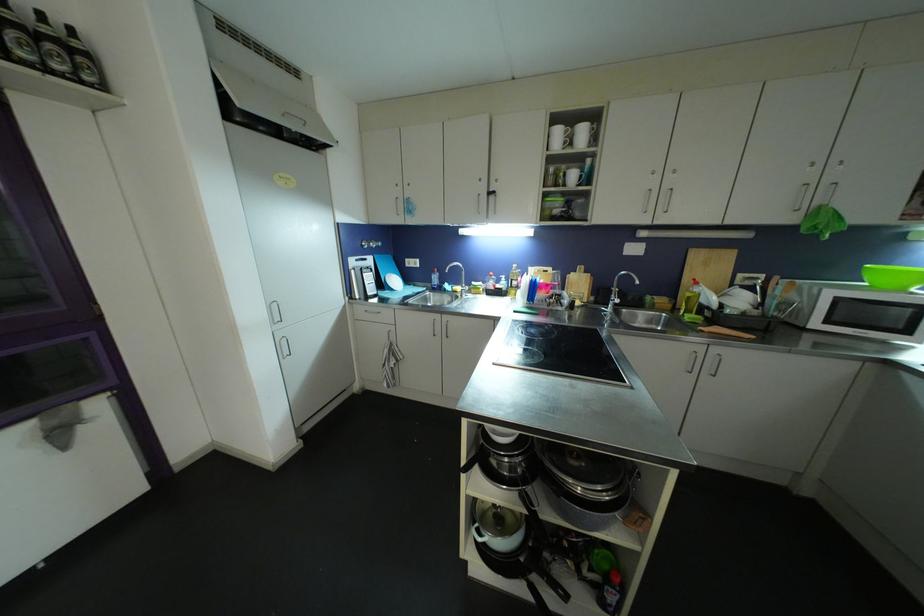
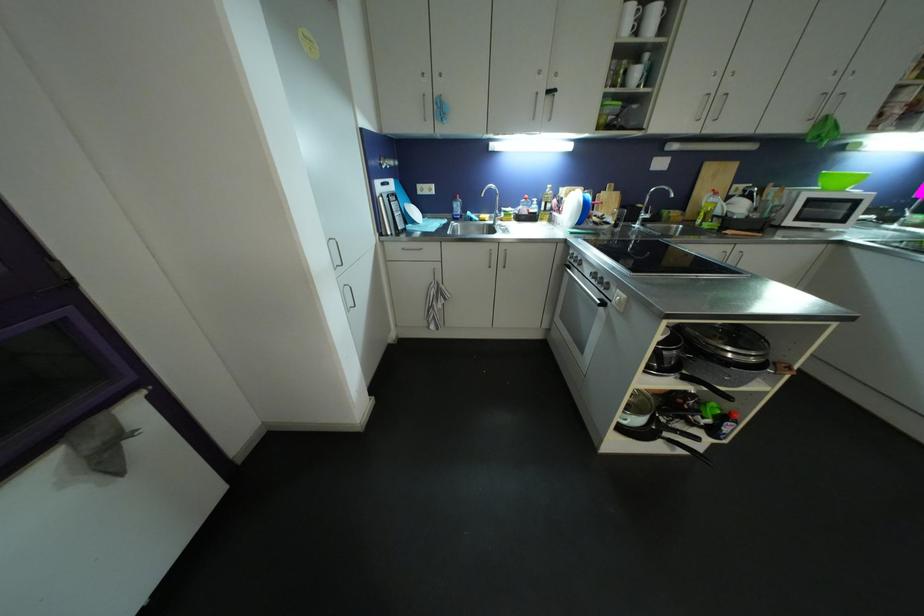
Where in the second image is the point corresponding to (x=436, y=283) from the first image?

(457, 213)